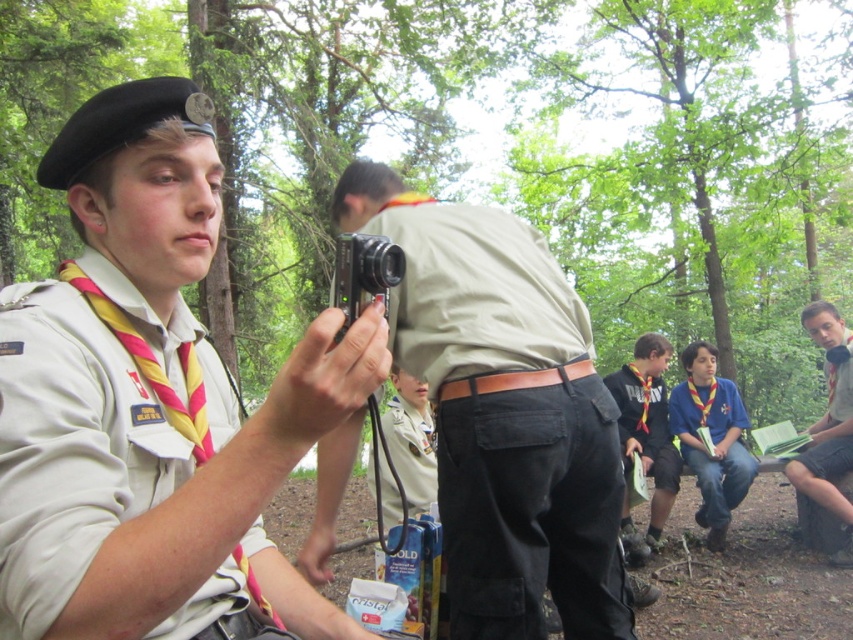
Question: Can you confirm if white cotton shirt at left is bigger than yellow fabric scarf at lower right?

Choices:
 (A) no
 (B) yes

Answer: (A)

Question: Estimate the real-world distances between objects in this image. Which object is closer to the light blue denim jeans at lower right?

Choices:
 (A) yellow fabric scarf at lower right
 (B) light gray cotton shirt at right
 (C) black plastic camera at center

Answer: (A)

Question: Which object is closer to the camera taking this photo?

Choices:
 (A) light blue denim jeans at lower right
 (B) white cotton shirt at left
 (C) light gray cotton shirt at right
 (D) black plastic camera at center

Answer: (B)

Question: Can you confirm if light gray cotton shirt at right is smaller than light brown leather belt at center?

Choices:
 (A) no
 (B) yes

Answer: (A)

Question: Is khaki fabric shirt at center further to the viewer compared to yellow fabric scarf at lower right?

Choices:
 (A) no
 (B) yes

Answer: (A)

Question: Which point appears closest to the camera in this image?

Choices:
 (A) (96, 541)
 (B) (688, 394)
 (C) (381, 289)
 (D) (450, 620)

Answer: (A)